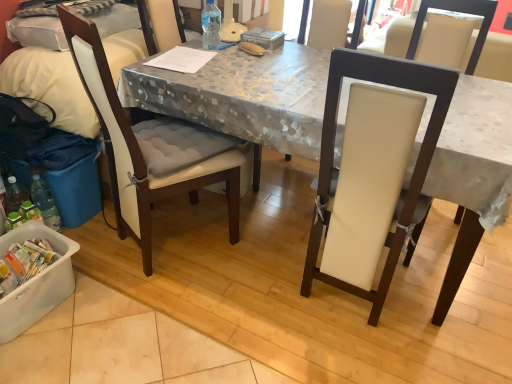
Image resolution: width=512 pixels, height=384 pixels. I want to click on vacant space in between white leather chair at center, acting as the first chair starting from the right, and white plastic container at lower left, so click(x=200, y=308).